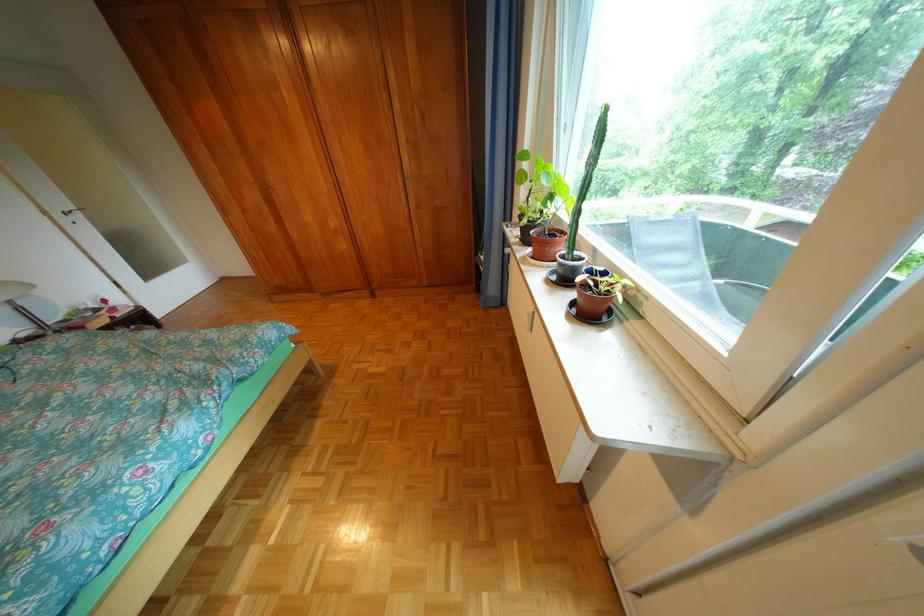
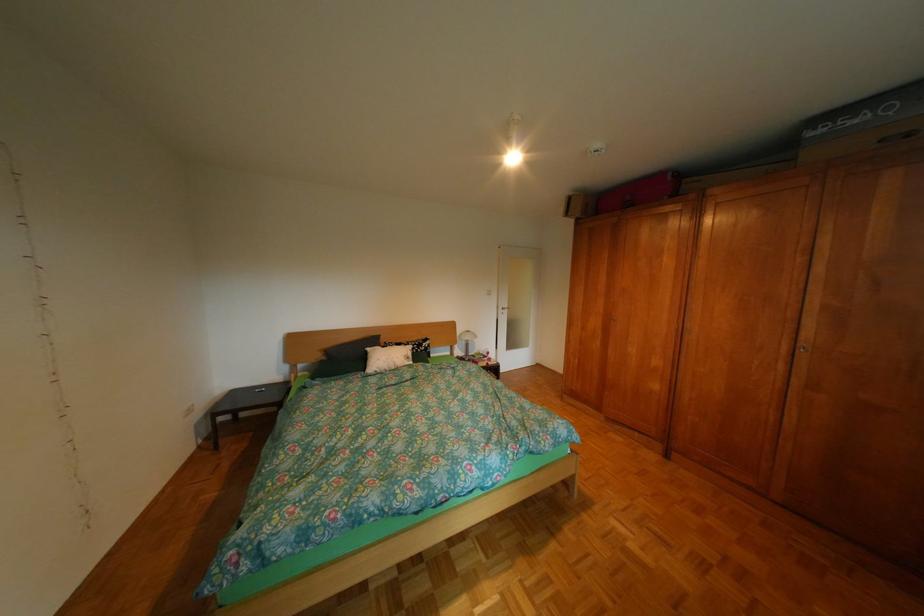
Question: How did the camera likely rotate?

Choices:
 (A) Left
 (B) Right
 (C) Up
 (D) Down

Answer: (A)